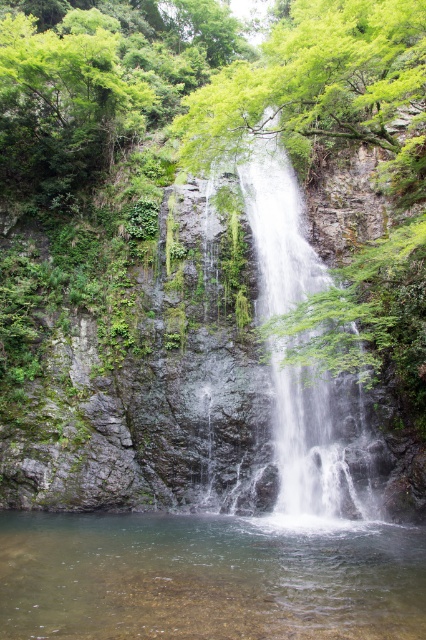
You are a hiker who wants to cross the waterfall area. You see clear water at bottom and clear water at center. Which one is safer to step on?

The clear water at center is safer to step on because it has a larger size compared to the clear water at bottom, making it more stable for walking.

You are a hiker who wants to cross the waterfall area. You see clear water at bottom and clear water at center. Which one should you avoid stepping into if you want to stay dry?

You should avoid stepping into the clear water at center because the clear water at bottom is to the left of it, implying the center water is the main flow and deeper, making it wetter.

You are standing at the top of the waterfall and want to reach the clear water at bottom. Which direction should you move to get there?

The clear water at bottom is located at point (207, 579), so you should move downward to reach it.